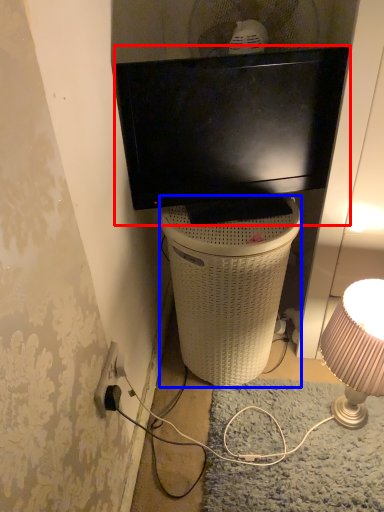
Question: Which point is closer to the camera, television (highlighted by a red box) or trash bin/can (highlighted by a blue box)?

Choices:
 (A) television
 (B) trash bin/can

Answer: (A)